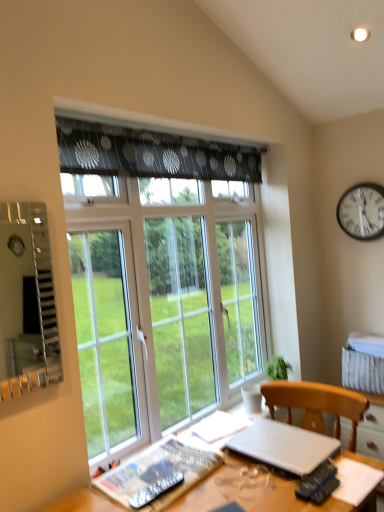
What are the coordinates of `free point above wooden desk at lower center (from a real-world perspective)` in the screenshot? It's located at (206, 467).